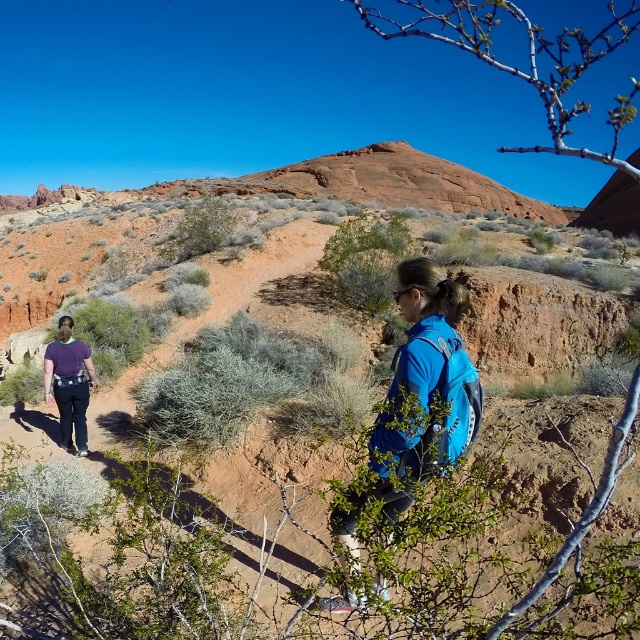
You are a hiker trying to decide which backpack to take with you on your desert hike. You see the blue fabric backpack at center and the purple fabric backpack at lower left. Which backpack is easier to reach without moving from your current position?

The blue fabric backpack at center is closer to the viewer than the purple fabric backpack at lower left, so it is easier to reach without moving from your current position.

You are a hiker in the desert and you see two backpacks, the blue fabric backpack at center and the purple fabric backpack at lower left. Which backpack is positioned to the right side of the other?

The blue fabric backpack at center is to the right of the purple fabric backpack at lower left.